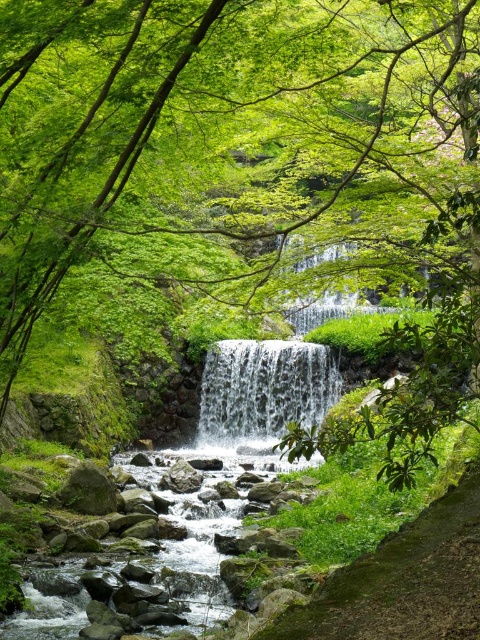
Is point (184, 552) positioned after point (296, 364)?

No, it is not.

Between green mossy rocks at center and clear water at center, which one is positioned higher?

clear water at center is higher up.

The width and height of the screenshot is (480, 640). Find the location of `green mossy rocks at center`. green mossy rocks at center is located at coordinates (207, 534).